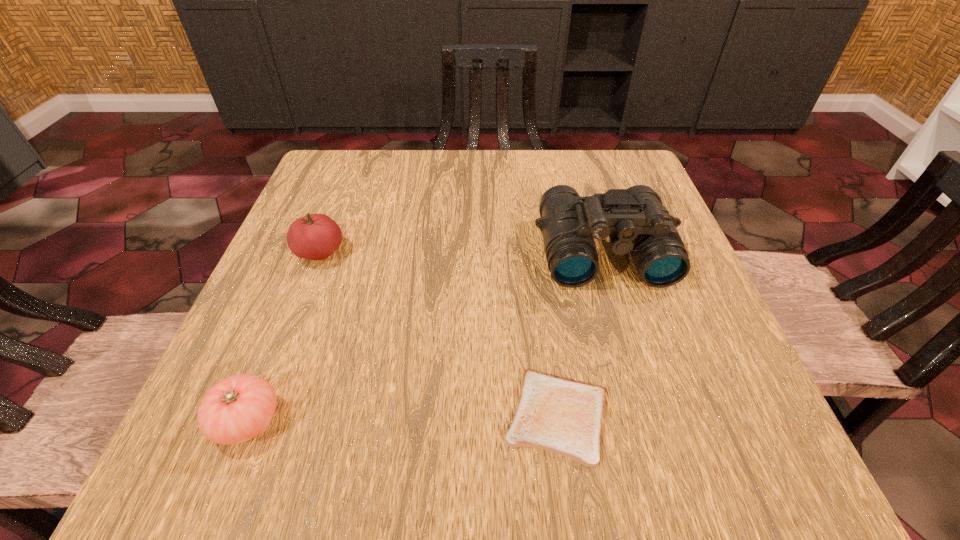
Select which object appears as the third closest to the second tallest object. Please provide its 2D coordinates. Your answer should be formatted as a tuple, i.e. [(x, y)], where the tuple contains the x and y coordinates of a point satisfying the conditions above.

[(563, 416)]

Where is `object that stands as the third closest to the toast`? The width and height of the screenshot is (960, 540). object that stands as the third closest to the toast is located at coordinates (315, 236).